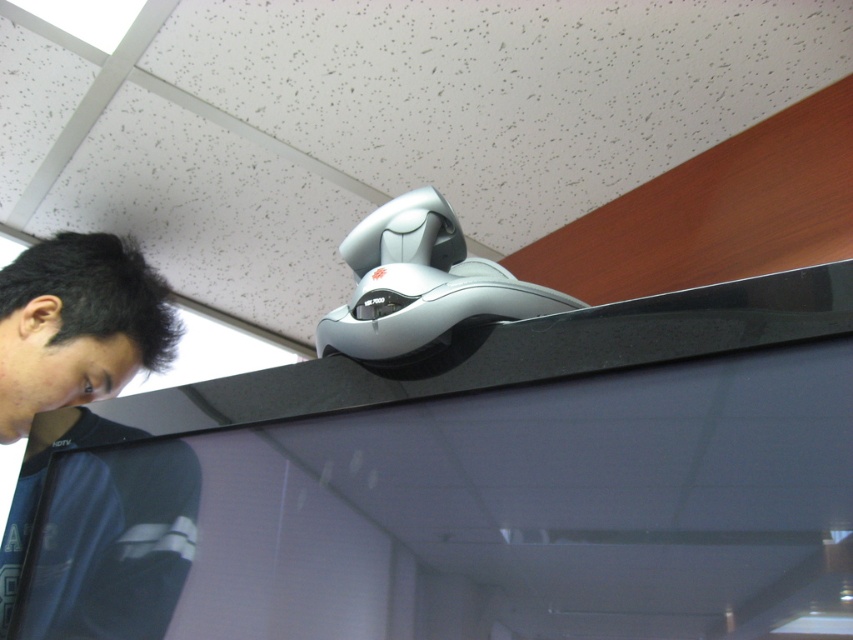
Question: Considering the real-world distances, which object is farthest from the black fabric at lower left?

Choices:
 (A) black matte hair at upper left
 (B) glossy plastic monitor at upper center

Answer: (B)

Question: Which of the following is the farthest from the observer?

Choices:
 (A) (683, 353)
 (B) (119, 332)
 (C) (138, 282)

Answer: (C)

Question: Is black fabric at lower left above black matte hair at upper left?

Choices:
 (A) no
 (B) yes

Answer: (A)

Question: Is glossy plastic monitor at upper center positioned before black fabric at lower left?

Choices:
 (A) yes
 (B) no

Answer: (A)

Question: Is the position of glossy plastic monitor at upper center less distant than that of black fabric at lower left?

Choices:
 (A) no
 (B) yes

Answer: (B)

Question: Which of the following is the closest to the observer?

Choices:
 (A) black fabric at lower left
 (B) glossy plastic monitor at upper center
 (C) black matte hair at upper left

Answer: (B)